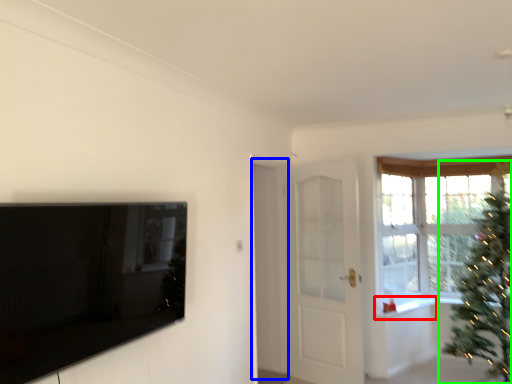
Question: Considering the real-world distances, which object is farthest from window sill (highlighted by a red box)? screen door (highlighted by a blue box) or christmas tree (highlighted by a green box)?

Choices:
 (A) screen door
 (B) christmas tree

Answer: (A)